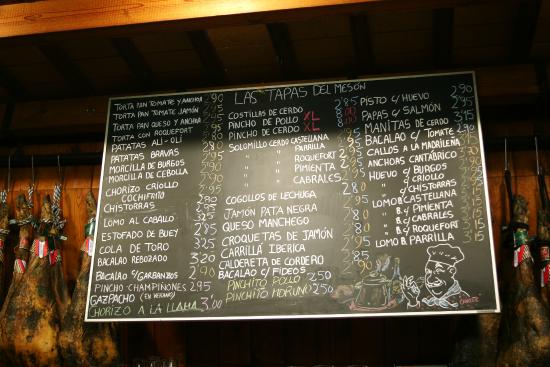
You are a GUI agent. You are given a task and a screenshot of the screen. Output one action in this format:
    pyautogui.click(x=<x>, y=<y>)
    Task: Click on the bottle
    
    Given the screenshot: What is the action you would take?
    pyautogui.click(x=395, y=278)